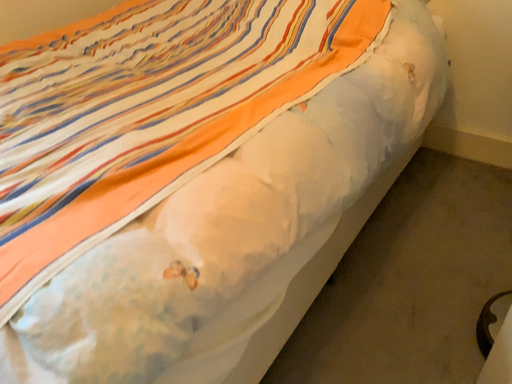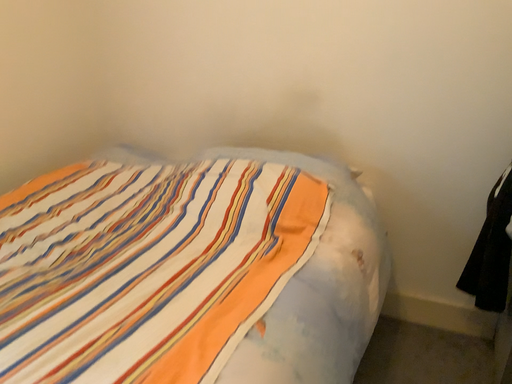
Question: Which way did the camera rotate in the video?

Choices:
 (A) rotated upward
 (B) rotated downward

Answer: (A)